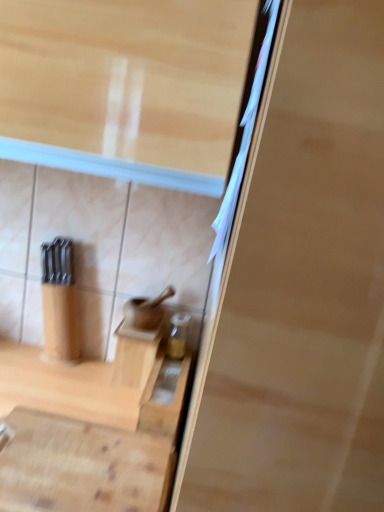
Question: Should I look upward or downward to see wooden cutting board at lower center, the second cabinetry viewed from the back?

Choices:
 (A) down
 (B) up

Answer: (A)

Question: Is wooden cabinet at center, acting as the 1th cabinetry starting from the back, positioned far away from wooden cutting board at lower center, the first cabinetry in the front-to-back sequence?

Choices:
 (A) yes
 (B) no

Answer: (B)

Question: Can you confirm if wooden cabinet at center, acting as the 1th cabinetry starting from the back, is taller than wooden cutting board at lower center, the second cabinetry viewed from the back?

Choices:
 (A) yes
 (B) no

Answer: (A)

Question: Is wooden cabinet at center, acting as the 1th cabinetry starting from the back, to the right of wooden cutting board at lower center, the first cabinetry in the front-to-back sequence, from the viewer's perspective?

Choices:
 (A) yes
 (B) no

Answer: (A)

Question: Can you confirm if wooden cabinet at center, acting as the 1th cabinetry starting from the back, is bigger than wooden cutting board at lower center, the first cabinetry in the front-to-back sequence?

Choices:
 (A) yes
 (B) no

Answer: (B)

Question: Does wooden cabinet at center, the second cabinetry when ordered from front to back, have a lesser height compared to wooden cutting board at lower center, the first cabinetry in the front-to-back sequence?

Choices:
 (A) no
 (B) yes

Answer: (A)

Question: Is wooden cabinet at center, the second cabinetry when ordered from front to back, facing towards wooden cutting board at lower center, the second cabinetry viewed from the back?

Choices:
 (A) yes
 (B) no

Answer: (A)

Question: Is the position of wooden cutting board at lower center, the first cabinetry in the front-to-back sequence, less distant than that of wooden cabinet at center, the second cabinetry when ordered from front to back?

Choices:
 (A) no
 (B) yes

Answer: (B)

Question: Is wooden cutting board at lower center, the second cabinetry viewed from the back, at the right side of wooden cabinet at center, acting as the 1th cabinetry starting from the back?

Choices:
 (A) no
 (B) yes

Answer: (A)

Question: Is wooden cutting board at lower center, the first cabinetry in the front-to-back sequence, directly adjacent to wooden cabinet at center, the second cabinetry when ordered from front to back?

Choices:
 (A) yes
 (B) no

Answer: (B)

Question: Does wooden cutting board at lower center, the first cabinetry in the front-to-back sequence, have a smaller size compared to wooden cabinet at center, the second cabinetry when ordered from front to back?

Choices:
 (A) yes
 (B) no

Answer: (B)

Question: From a real-world perspective, is wooden cutting board at lower center, the second cabinetry viewed from the back, on top of wooden cabinet at center, the second cabinetry when ordered from front to back?

Choices:
 (A) yes
 (B) no

Answer: (B)

Question: Is wooden cutting board at lower center, the second cabinetry viewed from the back, wider than wooden cabinet at center, the second cabinetry when ordered from front to back?

Choices:
 (A) yes
 (B) no

Answer: (A)

Question: From a real-world perspective, is wooden cabinet at center, acting as the 1th cabinetry starting from the back, physically located above or below wooden cutting board at lower center, the first cabinetry in the front-to-back sequence?

Choices:
 (A) above
 (B) below

Answer: (A)